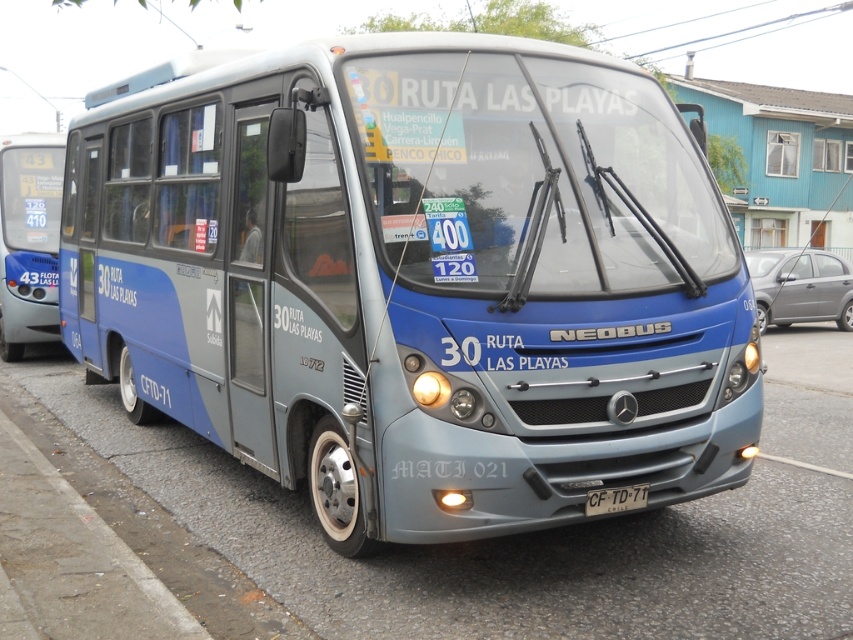
Question: In this image, where is blue metallic bus at left located relative to white plastic license plate at center?

Choices:
 (A) above
 (B) below

Answer: (A)

Question: Is blue metallic bus at center smaller than white plastic license plate at center?

Choices:
 (A) yes
 (B) no

Answer: (B)

Question: Does blue metallic bus at left have a lesser width compared to white plastic license plate at center?

Choices:
 (A) no
 (B) yes

Answer: (A)

Question: Estimate the real-world distances between objects in this image. Which object is farther from the white plastic license plate at center?

Choices:
 (A) blue metallic bus at center
 (B) blue metallic bus at left

Answer: (B)

Question: Among these points, which one is farthest from the camera?

Choices:
 (A) (450, 445)
 (B) (57, 189)
 (C) (636, 488)

Answer: (B)

Question: Which object is the farthest from the blue metallic bus at left?

Choices:
 (A) white plastic license plate at center
 (B) blue metallic bus at center

Answer: (A)